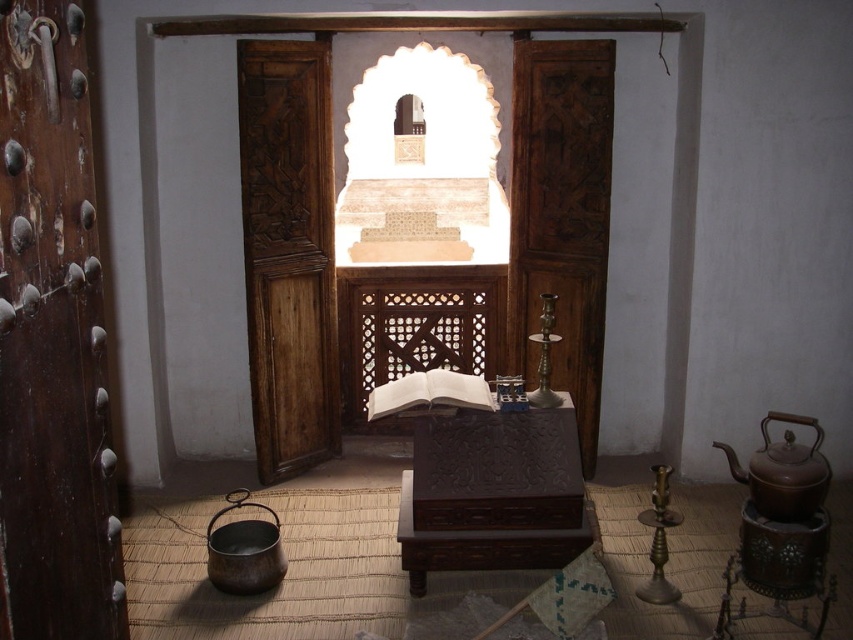
Between wooden carved door at center and dark wood carved door at center, which one appears on the left side from the viewer's perspective?

wooden carved door at center is more to the left.

What do you see at coordinates (288, 252) in the screenshot? The height and width of the screenshot is (640, 853). I see `wooden carved door at center` at bounding box center [288, 252].

Where is `wooden carved door at center`? The image size is (853, 640). wooden carved door at center is located at coordinates (288, 252).

Can you confirm if dark brown wood door at left is smaller than matte brown teapot at lower right?

Yes, dark brown wood door at left is smaller than matte brown teapot at lower right.

Who is shorter, dark brown wood door at left or matte brown teapot at lower right?

Standing shorter between the two is matte brown teapot at lower right.

Between point (9, 232) and point (830, 476), which one is positioned in front?

Point (9, 232)

The height and width of the screenshot is (640, 853). Identify the location of dark brown wood door at left. (51, 342).

Does dark brown wood door at left have a smaller size compared to dark wood carved door at center?

Yes, dark brown wood door at left is smaller than dark wood carved door at center.

Which of these two, dark brown wood door at left or dark wood carved door at center, stands taller?

dark wood carved door at center is taller.

Describe the element at coordinates (51, 342) in the screenshot. I see `dark brown wood door at left` at that location.

This screenshot has width=853, height=640. What are the coordinates of `dark brown wood door at left` in the screenshot? It's located at (51, 342).